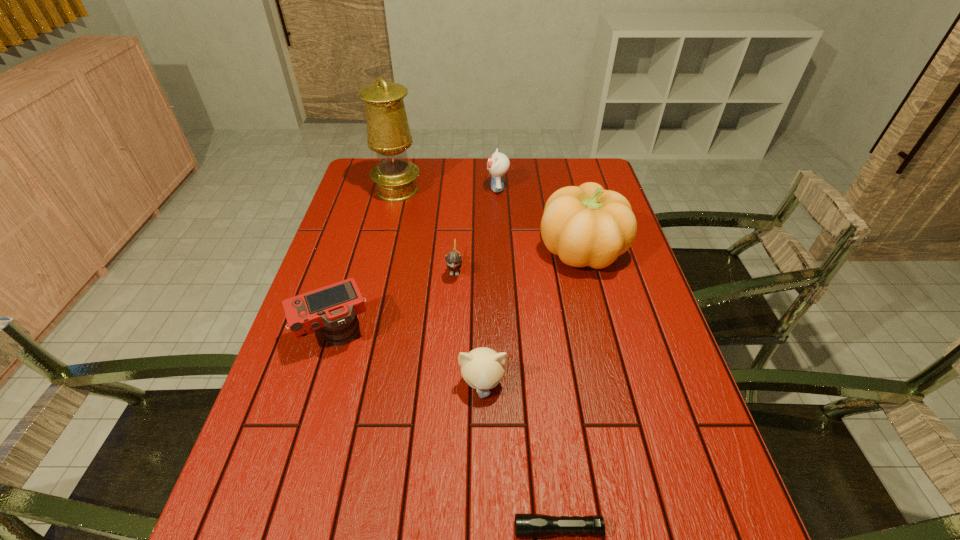
The width and height of the screenshot is (960, 540). I want to click on object at the right edge, so click(x=585, y=226).

Identify the location of object that is at the far left corner. Image resolution: width=960 pixels, height=540 pixels. (388, 132).

Locate an element on the screen. The image size is (960, 540). vacant area at the far edge is located at coordinates (544, 178).

Where is `blank space at the left edge of the desktop`? The image size is (960, 540). blank space at the left edge of the desktop is located at coordinates (379, 249).

I want to click on vacant space at the right edge of the desktop, so click(698, 481).

You are a GUI agent. You are given a task and a screenshot of the screen. Output one action in this format:
    pyautogui.click(x=<x>, y=<y>)
    Task: Click on the unoccupied area between the camera and the shortest kitten
    
    Given the screenshot: What is the action you would take?
    pyautogui.click(x=395, y=301)

You are a GUI agent. You are given a task and a screenshot of the screen. Output one action in this format:
    pyautogui.click(x=<x>, y=<y>)
    Task: Click on the free space between the pumpkin and the third nearest object
    The height and width of the screenshot is (540, 960).
    Given the screenshot: What is the action you would take?
    pyautogui.click(x=459, y=292)

The image size is (960, 540). What are the coordinates of `empty location between the farthest kitten and the leftmost kitten` in the screenshot? It's located at (476, 228).

Find the location of a particular element. vacant space that is in between the tallest kitten and the pumpkin is located at coordinates (540, 219).

Where is `vacant space that's between the fifth farthest object and the oil lamp`? vacant space that's between the fifth farthest object and the oil lamp is located at coordinates (366, 263).